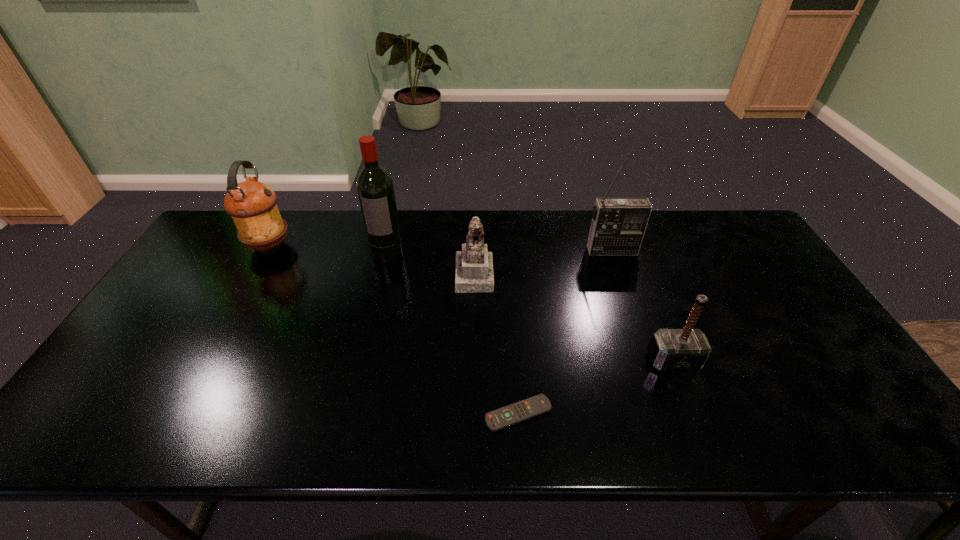
Find the location of a particular element. The height and width of the screenshot is (540, 960). vacant space that satisfies the following two spatial constraints: 1. on the display of the radio receiver; 2. on the front-facing side of the figurine is located at coordinates (621, 274).

The width and height of the screenshot is (960, 540). Identify the location of free point that satisfies the following two spatial constraints: 1. on the front-facing side of the hammer; 2. on the right side of the figurine. (472, 360).

I want to click on vacant region that satisfies the following two spatial constraints: 1. on the front-facing side of the figurine; 2. on the left side of the hammer, so click(472, 360).

At what (x,y) coordinates should I click in order to perform the action: click on free point that satisfies the following two spatial constraints: 1. on the display of the hammer; 2. on the right side of the radio receiver. Please return your answer as a coordinate pair (x, y). The image size is (960, 540). Looking at the image, I should click on (650, 360).

Locate an element on the screen. free region that satisfies the following two spatial constraints: 1. on the label of the second nearest object; 2. on the right side of the fifth object from right to left is located at coordinates (361, 360).

What are the coordinates of `vacant space that satisfies the following two spatial constraints: 1. on the display of the radio receiver; 2. on the left side of the fifth farthest object` in the screenshot? It's located at (650, 360).

The width and height of the screenshot is (960, 540). What are the coordinates of `vacant point that satisfies the following two spatial constraints: 1. on the display of the radio receiver; 2. on the front-facing side of the figurine` in the screenshot? It's located at (621, 274).